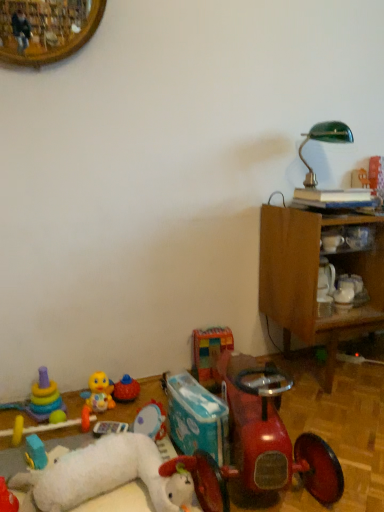
Question: Is shiny red toy car at lower right turned away from stacked plastic rings at lower left, the 9th toy from the right?

Choices:
 (A) no
 (B) yes

Answer: (A)

Question: Is shiny red toy car at lower right aimed at stacked plastic rings at lower left, which appears as the 2th toy when viewed from the left?

Choices:
 (A) no
 (B) yes

Answer: (A)

Question: Can you confirm if shiny red toy car at lower right is bigger than stacked plastic rings at lower left, which appears as the 2th toy when viewed from the left?

Choices:
 (A) no
 (B) yes

Answer: (B)

Question: Can we say shiny red toy car at lower right lies outside stacked plastic rings at lower left, the 9th toy from the right?

Choices:
 (A) no
 (B) yes

Answer: (B)

Question: Is stacked plastic rings at lower left, which appears as the 2th toy when viewed from the left, located within shiny red toy car at lower right?

Choices:
 (A) no
 (B) yes

Answer: (A)

Question: Is shiny red toy car at lower right positioned before stacked plastic rings at lower left, which appears as the 2th toy when viewed from the left?

Choices:
 (A) no
 (B) yes

Answer: (B)

Question: From a real-world perspective, is rubberized red tricycle at lower center, which ranks as the tenth toy in left-to-right order, located higher than stacked plastic rings at lower left, the 9th toy from the right?

Choices:
 (A) yes
 (B) no

Answer: (B)

Question: Is rubberized red tricycle at lower center, which ranks as the tenth toy in left-to-right order, shorter than stacked plastic rings at lower left, which appears as the 2th toy when viewed from the left?

Choices:
 (A) yes
 (B) no

Answer: (A)

Question: Is the position of rubberized red tricycle at lower center, positioned as the 1th toy in right-to-left order, less distant than that of stacked plastic rings at lower left, which appears as the 2th toy when viewed from the left?

Choices:
 (A) yes
 (B) no

Answer: (A)

Question: Is rubberized red tricycle at lower center, which ranks as the tenth toy in left-to-right order, not near stacked plastic rings at lower left, which appears as the 2th toy when viewed from the left?

Choices:
 (A) no
 (B) yes

Answer: (A)

Question: Is rubberized red tricycle at lower center, which ranks as the tenth toy in left-to-right order, to the right of stacked plastic rings at lower left, which appears as the 2th toy when viewed from the left, from the viewer's perspective?

Choices:
 (A) no
 (B) yes

Answer: (B)

Question: Is rubberized red tricycle at lower center, positioned as the 1th toy in right-to-left order, with stacked plastic rings at lower left, the 9th toy from the right?

Choices:
 (A) no
 (B) yes

Answer: (A)

Question: Is plush yellow duck at lower left, arranged as the fifth toy when viewed from the left, not close to multicolored fabric blocks at center, acting as the second toy starting from the right?

Choices:
 (A) no
 (B) yes

Answer: (A)